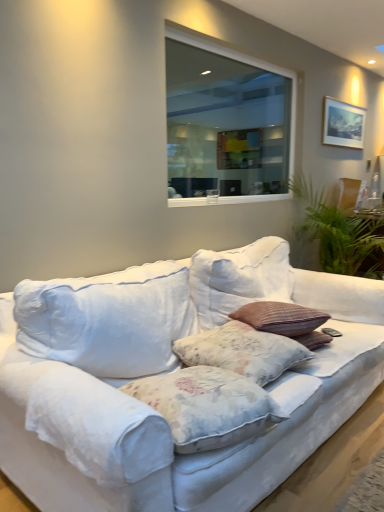
Identify the location of free spot above metallic silver picture frame at upper right (from a real-world perspective). The height and width of the screenshot is (512, 384). point(337,100).